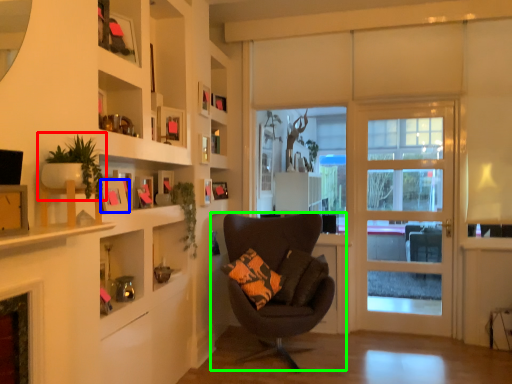
Question: Based on their relative distances, which object is farther from houseplant (highlighted by a red box)? Choose from picture frame (highlighted by a blue box) and chair (highlighted by a green box).

Choices:
 (A) picture frame
 (B) chair

Answer: (B)